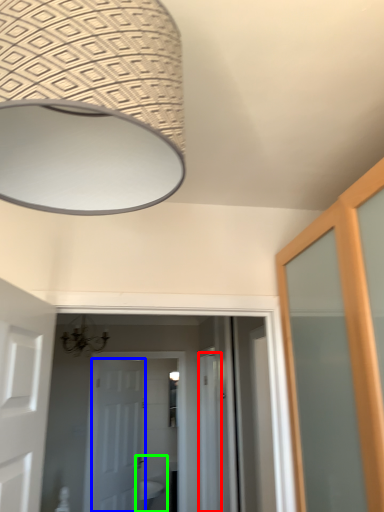
Question: Which object is the farthest from screen door (highlighted by a red box)? Choose among these: door (highlighted by a blue box) or sink (highlighted by a green box).

Choices:
 (A) door
 (B) sink

Answer: (B)